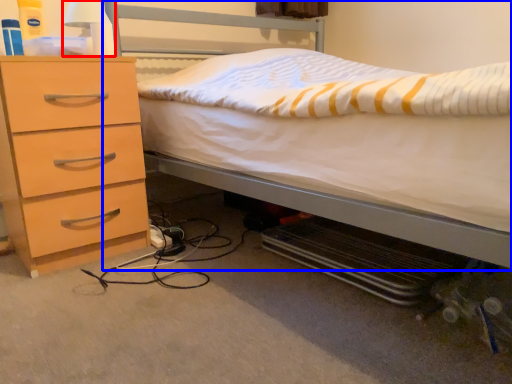
Question: Which point is closer to the camera, bedside lamp (highlighted by a red box) or bed (highlighted by a blue box)?

Choices:
 (A) bedside lamp
 (B) bed

Answer: (B)